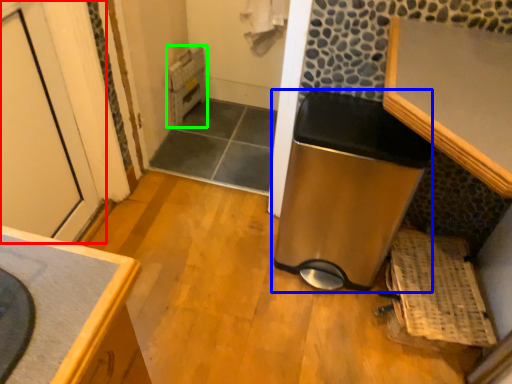
Question: Based on their relative distances, which object is nearer to door (highlighted by a red box)? Choose from water heater (highlighted by a blue box) and water heater (highlighted by a green box).

Choices:
 (A) water heater
 (B) water heater

Answer: (B)